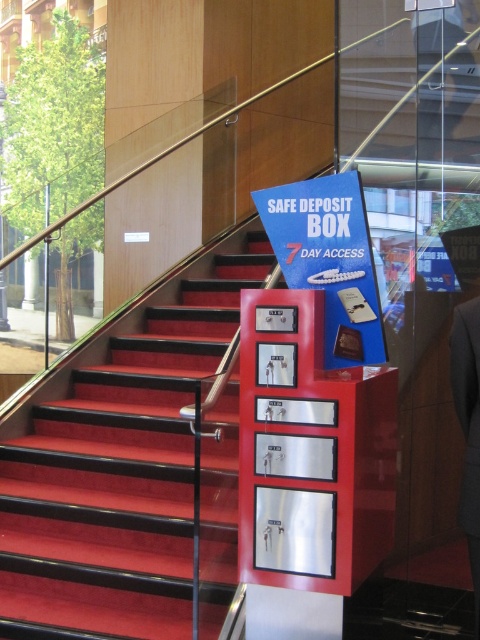
Question: Which point is closer to the camera?

Choices:
 (A) (116, 547)
 (B) (468, 284)

Answer: (B)

Question: Does red carpeted stairs at center appear on the right side of dark gray suit at center?

Choices:
 (A) yes
 (B) no

Answer: (B)

Question: Is red carpeted stairs at center thinner than dark gray suit at center?

Choices:
 (A) yes
 (B) no

Answer: (B)

Question: Which point is closer to the camera taking this photo?

Choices:
 (A) click(x=479, y=544)
 (B) click(x=17, y=488)

Answer: (A)

Question: Does red carpeted stairs at center appear on the right side of dark gray suit at center?

Choices:
 (A) no
 (B) yes

Answer: (A)